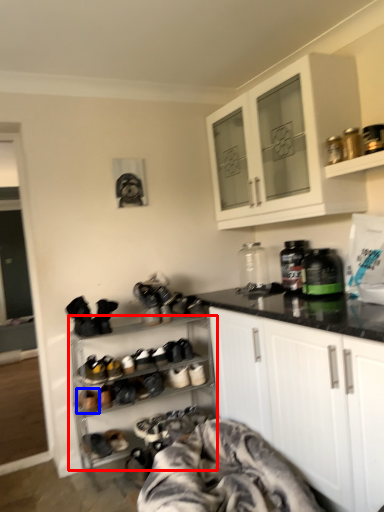
Question: Which point is further to the camera, shelf (highlighted by a red box) or footwear (highlighted by a blue box)?

Choices:
 (A) shelf
 (B) footwear

Answer: (B)